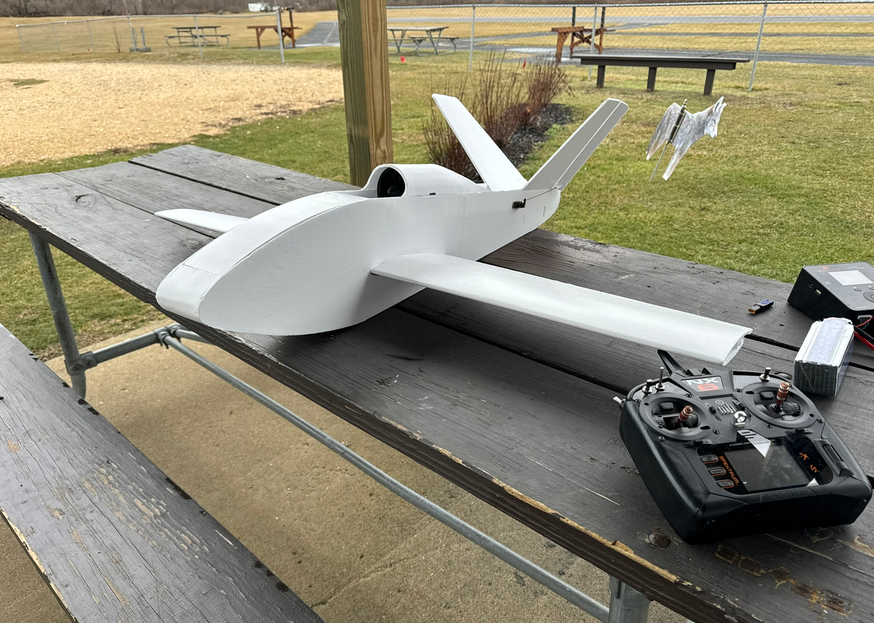
Locate an element on the screen. remote control is located at coordinates (727, 454).